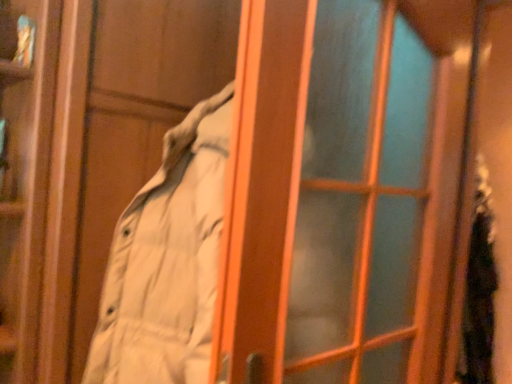
Question: In terms of size, does fuzzy black scarf at right appear bigger or smaller than translucent glass screen door at center?

Choices:
 (A) small
 (B) big

Answer: (A)

Question: Is point click(492, 261) closer or farther from the camera than point click(362, 175)?

Choices:
 (A) farther
 (B) closer

Answer: (A)

Question: From a real-world perspective, is fuzzy black scarf at right above or below translucent glass screen door at center?

Choices:
 (A) below
 (B) above

Answer: (A)

Question: Does point (385, 145) appear closer or farther from the camera than point (490, 220)?

Choices:
 (A) closer
 (B) farther

Answer: (A)

Question: Based on their sizes in the image, would you say translucent glass screen door at center is bigger or smaller than fuzzy black scarf at right?

Choices:
 (A) big
 (B) small

Answer: (A)

Question: Is translucent glass screen door at center wider or thinner than fuzzy black scarf at right?

Choices:
 (A) wide
 (B) thin

Answer: (B)

Question: From the image's perspective, is translucent glass screen door at center positioned above or below fuzzy black scarf at right?

Choices:
 (A) below
 (B) above

Answer: (B)